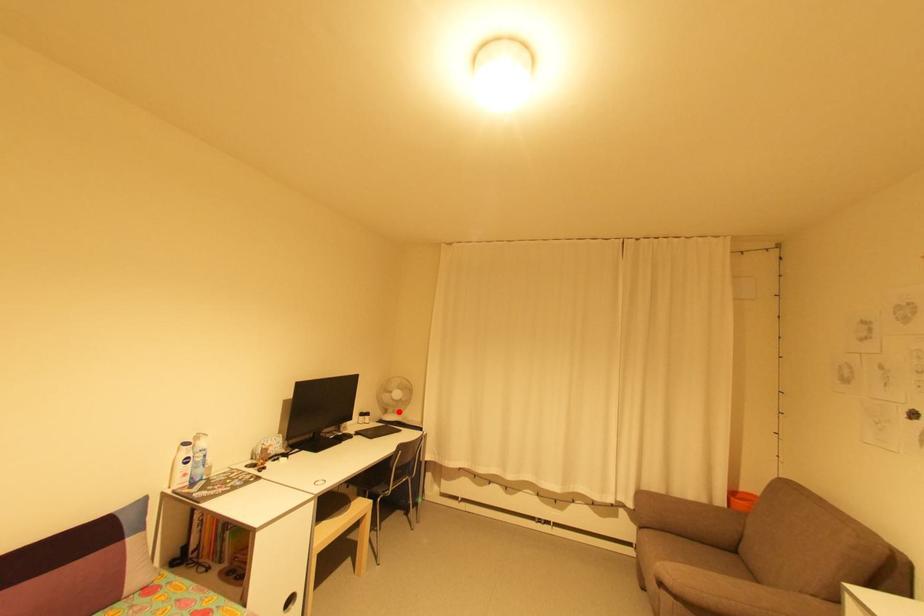
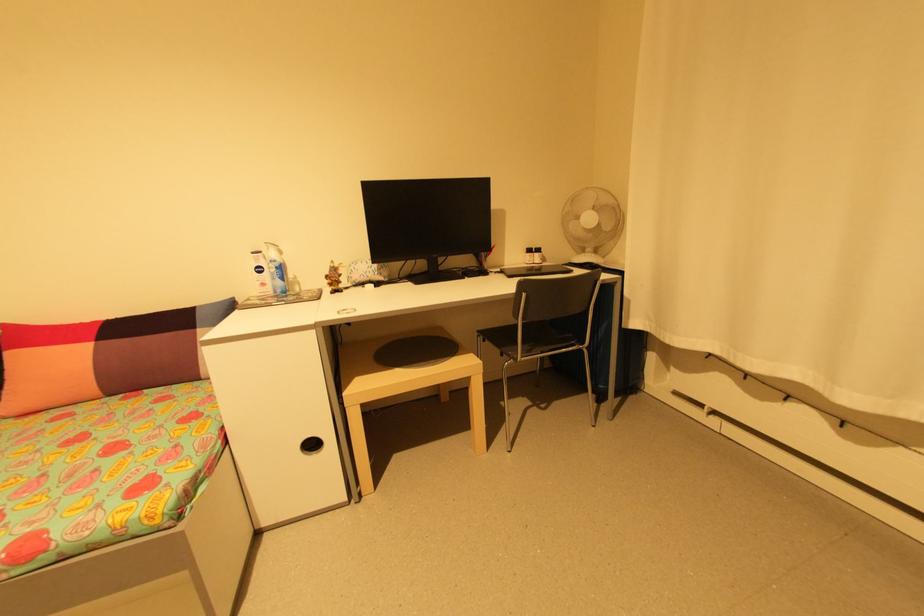
Question: I am providing you with two images of the same scene from different viewpoints. A red point is marked on the first image. Is the red point's position out of view in image 2?

Choices:
 (A) Yes
 (B) No

Answer: (B)